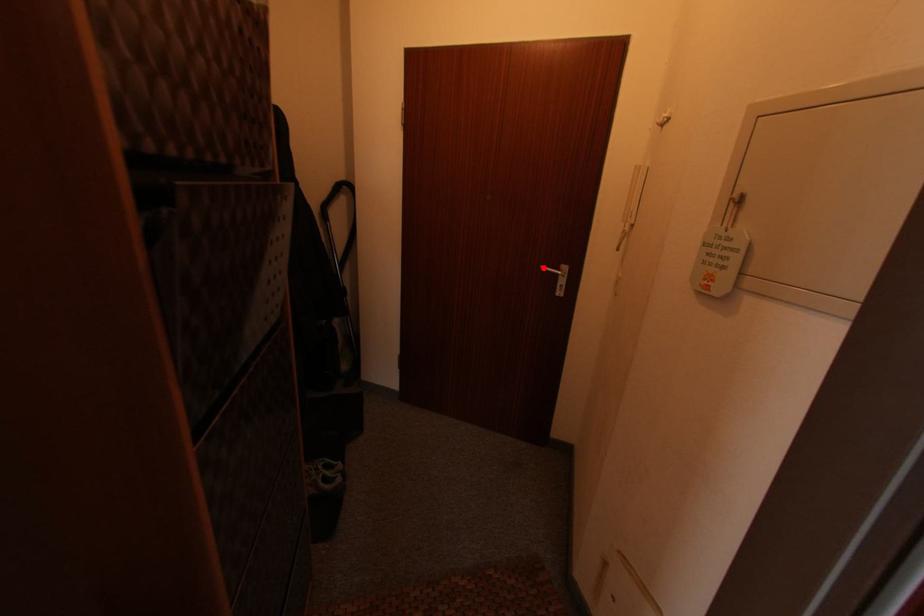
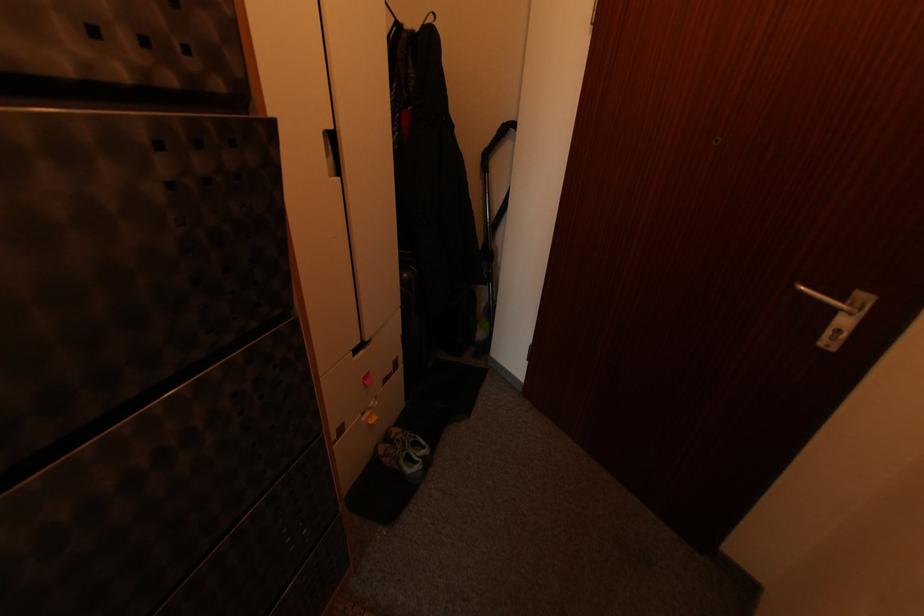
Where in the second image is the point corresponding to the highlighted location from the first image?

(804, 289)